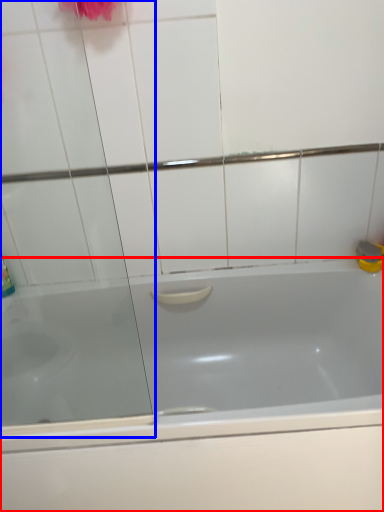
Question: Which of the following is the closest to the observer, bathtub (highlighted by a red box) or screen door (highlighted by a blue box)?

Choices:
 (A) bathtub
 (B) screen door

Answer: (B)